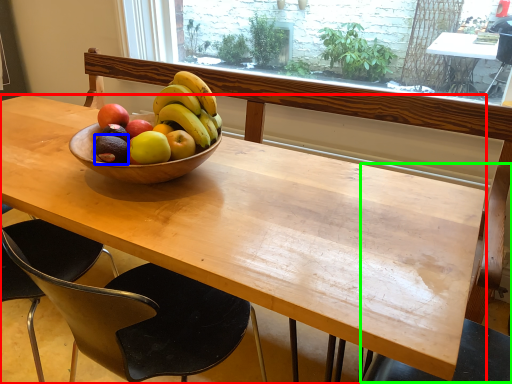
Question: Based on their relative distances, which object is nearer to desk (highlighted by a red box)? Choose from avocado (highlighted by a blue box) and chair (highlighted by a green box).

Choices:
 (A) avocado
 (B) chair

Answer: (A)